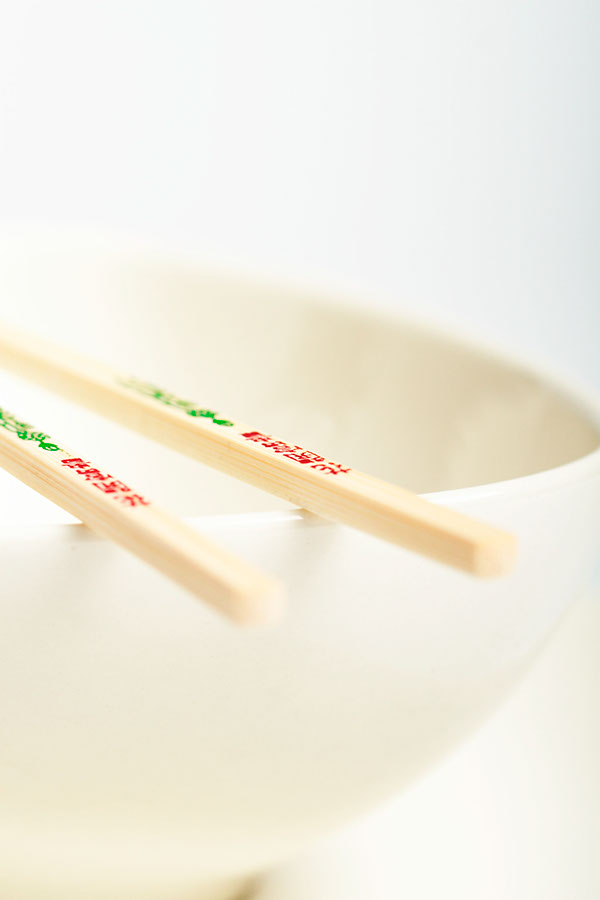
Identify the location of bowl interior. (391, 402).